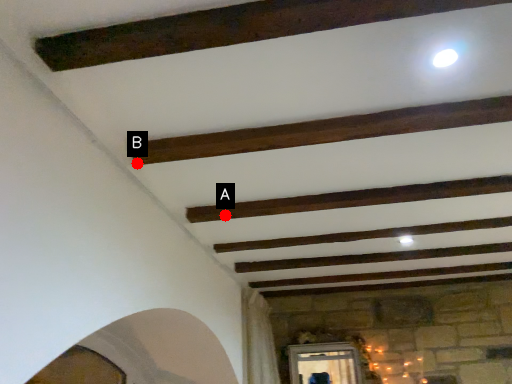
Question: Two points are circled on the image, labeled by A and B beside each circle. Which point is closer to the camera taking this photo?

Choices:
 (A) A is closer
 (B) B is closer

Answer: (B)